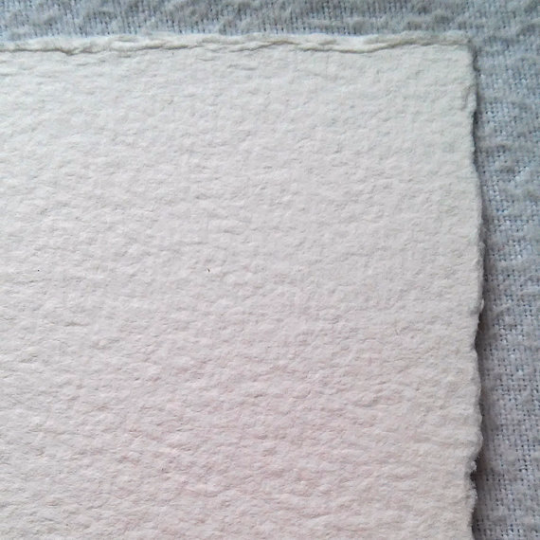
Locate an element on the screen. The image size is (540, 540). linen is located at coordinates (499, 163).